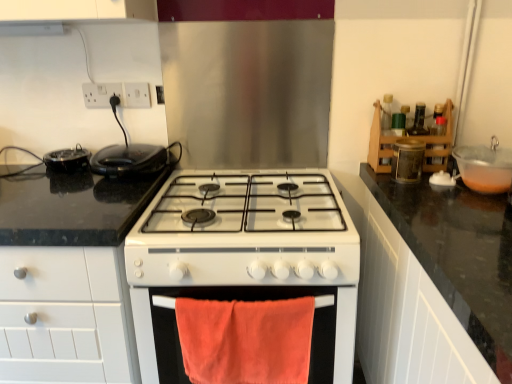
Identify the location of white plastic socket at upper left, which is the 2th electric outlet in left-to-right order. (137, 95).

What do you see at coordinates (439, 142) in the screenshot? Image resolution: width=512 pixels, height=384 pixels. I see `wooden spice rack at upper right` at bounding box center [439, 142].

The image size is (512, 384). I want to click on black granite countertop at left, so click(x=68, y=277).

From the image's perspective, is matte brown container at upper right below black glossy pan at left, arranged as the 2th kitchen appliance when viewed from the right?

Incorrect, from the image's perspective, matte brown container at upper right is higher than black glossy pan at left, arranged as the 2th kitchen appliance when viewed from the right.

Is matte brown container at upper right with black glossy pan at left, which ranks as the 1th kitchen appliance in left-to-right order?

No, matte brown container at upper right is not next to black glossy pan at left, which ranks as the 1th kitchen appliance in left-to-right order.

Is matte brown container at upper right bigger than black glossy pan at left, which ranks as the 1th kitchen appliance in left-to-right order?

Indeed, matte brown container at upper right has a larger size compared to black glossy pan at left, which ranks as the 1th kitchen appliance in left-to-right order.

What's the angular difference between orange cotton towel at lower center and white plastic socket at upper left, which appears as the second electric outlet when viewed from the right,'s facing directions?

There is a 0.0215-degree angle between the facing directions of orange cotton towel at lower center and white plastic socket at upper left, which appears as the second electric outlet when viewed from the right.

Which object is further away from the camera, orange cotton towel at lower center or white plastic socket at upper left, which appears as the 1th electric outlet when viewed from the left?

A: Positioned behind is white plastic socket at upper left, which appears as the 1th electric outlet when viewed from the left.

Does orange cotton towel at lower center touch white plastic socket at upper left, which appears as the 1th electric outlet when viewed from the left?

orange cotton towel at lower center and white plastic socket at upper left, which appears as the 1th electric outlet when viewed from the left, are not in contact.

Can you confirm if orange cotton towel at lower center is bigger than white plastic socket at upper left, which appears as the 1th electric outlet when viewed from the left?

Yes, orange cotton towel at lower center is bigger than white plastic socket at upper left, which appears as the 1th electric outlet when viewed from the left.

Can we say transparent plastic bowl at right lies outside white glossy exhaust hood at upper center?

Yes, transparent plastic bowl at right is located beyond the bounds of white glossy exhaust hood at upper center.

From a real-world perspective, is transparent plastic bowl at right below white glossy exhaust hood at upper center?

Yes, from a real-world perspective, transparent plastic bowl at right is below white glossy exhaust hood at upper center.

Is transparent plastic bowl at right positioned with its back to white glossy exhaust hood at upper center?

No, transparent plastic bowl at right is not facing the opposite direction of white glossy exhaust hood at upper center.

Looking at this image, is white plastic socket at upper left, which is the 2th electric outlet in left-to-right order, bigger than matte brown container at upper right?

Actually, white plastic socket at upper left, which is the 2th electric outlet in left-to-right order, might be smaller than matte brown container at upper right.

From the image's perspective, between white plastic socket at upper left, which is the 2th electric outlet in left-to-right order, and matte brown container at upper right, who is located below?

matte brown container at upper right appears lower in the image.

From a real-world perspective, does white plastic socket at upper left, which is counted as the first electric outlet, starting from the right, stand above matte brown container at upper right?

Indeed, from a real-world perspective, white plastic socket at upper left, which is counted as the first electric outlet, starting from the right, stands above matte brown container at upper right.

Is white plastic socket at upper left, which is counted as the first electric outlet, starting from the right, turned away from matte brown container at upper right?

No, matte brown container at upper right is not at the back of white plastic socket at upper left, which is counted as the first electric outlet, starting from the right.

Is orange cotton towel at lower center directly adjacent to black glossy waffle maker at left, which is the 1th kitchen appliance in right-to-left order?

orange cotton towel at lower center and black glossy waffle maker at left, which is the 1th kitchen appliance in right-to-left order, are clearly separated.

From a real-world perspective, which object stands above the other?

In real-world perspective, black glossy waffle maker at left, arranged as the second kitchen appliance when viewed from the left, is above.

Is orange cotton towel at lower center wider or thinner than black glossy waffle maker at left, which is the 1th kitchen appliance in right-to-left order?

In the image, orange cotton towel at lower center appears to be more narrow than black glossy waffle maker at left, which is the 1th kitchen appliance in right-to-left order.

From a real-world perspective, which object rests below the other?

black glossy pan at left, arranged as the 2th kitchen appliance when viewed from the right, is physically lower.

Is white glossy exhaust hood at upper center located outside black glossy pan at left, which ranks as the 1th kitchen appliance in left-to-right order?

white glossy exhaust hood at upper center is positioned outside black glossy pan at left, which ranks as the 1th kitchen appliance in left-to-right order.

In terms of height, does white glossy exhaust hood at upper center look taller or shorter compared to black glossy pan at left, arranged as the 2th kitchen appliance when viewed from the right?

Clearly, white glossy exhaust hood at upper center is shorter compared to black glossy pan at left, arranged as the 2th kitchen appliance when viewed from the right.

Considering the relative sizes of white glossy exhaust hood at upper center and black glossy pan at left, arranged as the 2th kitchen appliance when viewed from the right, in the image provided, is white glossy exhaust hood at upper center wider than black glossy pan at left, arranged as the 2th kitchen appliance when viewed from the right,?

No, white glossy exhaust hood at upper center is not wider than black glossy pan at left, arranged as the 2th kitchen appliance when viewed from the right.

In the scene shown: From the image's perspective, is matte brown container at upper right on white glossy gas stove at center?

Indeed, from the image's perspective, matte brown container at upper right is shown above white glossy gas stove at center.

Considering the relative positions of matte brown container at upper right and white glossy gas stove at center in the image provided, is matte brown container at upper right behind white glossy gas stove at center?

Yes, matte brown container at upper right is further from the viewer.

Is white glossy gas stove at center surrounded by matte brown container at upper right?

No, white glossy gas stove at center is not surrounded by matte brown container at upper right.

How distant is matte brown container at upper right from white glossy gas stove at center?

matte brown container at upper right is 51.75 centimeters from white glossy gas stove at center.

Where is `the 1st kitchen appliance below the matte brown container at upper right (from the image's perspective)`? The width and height of the screenshot is (512, 384). the 1st kitchen appliance below the matte brown container at upper right (from the image's perspective) is located at coordinates (67, 159).

Locate an element on the screen. The height and width of the screenshot is (384, 512). oven on the right side of white plastic socket at upper left, which appears as the second electric outlet when viewed from the right is located at coordinates (243, 300).

When comparing their distances from wooden spice rack at upper right, does white plastic socket at upper left, which appears as the 1th electric outlet when viewed from the left, or orange cotton towel at lower center seem closer?

orange cotton towel at lower center.

Estimate the real-world distances between objects in this image. Which object is closer to white glossy exhaust hood at upper center, white plastic socket at upper left, which is counted as the first electric outlet, starting from the right, or transparent plastic bowl at right?

Among the two, white plastic socket at upper left, which is counted as the first electric outlet, starting from the right, is located nearer to white glossy exhaust hood at upper center.

Considering their positions, is wooden spice rack at upper right positioned further to white glossy gas stove at center than black glossy pan at left, which ranks as the 1th kitchen appliance in left-to-right order?

black glossy pan at left, which ranks as the 1th kitchen appliance in left-to-right order, is further to white glossy gas stove at center.

Based on their spatial positions, is white plastic socket at upper left, which appears as the second electric outlet when viewed from the right, or white glossy gas stove at center further from orange cotton towel at lower center?

white plastic socket at upper left, which appears as the second electric outlet when viewed from the right, is positioned further to the anchor orange cotton towel at lower center.

Estimate the real-world distances between objects in this image. Which object is closer to black glossy waffle maker at left, which is the 1th kitchen appliance in right-to-left order, white plastic socket at upper left, which is the 2th electric outlet in left-to-right order, or black glossy pan at left, arranged as the 2th kitchen appliance when viewed from the right?

black glossy pan at left, arranged as the 2th kitchen appliance when viewed from the right, is positioned closer to the anchor black glossy waffle maker at left, which is the 1th kitchen appliance in right-to-left order.

Estimate the real-world distances between objects in this image. Which object is closer to black glossy waffle maker at left, which is the 1th kitchen appliance in right-to-left order, white glossy gas stove at center or matte brown container at upper right?

white glossy gas stove at center lies closer to black glossy waffle maker at left, which is the 1th kitchen appliance in right-to-left order, than the other object.

Considering their positions, is black granite countertop at left positioned closer to wooden spice rack at upper right than transparent plastic bowl at right?

transparent plastic bowl at right is positioned closer to the anchor wooden spice rack at upper right.

Estimate the real-world distances between objects in this image. Which object is further from white glossy exhaust hood at upper center, black granite countertop at left or transparent plastic bowl at right?

The object further to white glossy exhaust hood at upper center is transparent plastic bowl at right.

At what (x,y) coordinates should I click in order to perform the action: click on appliance located between black glossy waffle maker at left, arranged as the second kitchen appliance when viewed from the left, and wooden spice rack at upper right in the left-right direction. Please return your answer as a coordinate pair (x, y). Image resolution: width=512 pixels, height=384 pixels. Looking at the image, I should click on (407, 160).

Locate an element on the screen. Image resolution: width=512 pixels, height=384 pixels. oven between white plastic socket at upper left, which is counted as the first electric outlet, starting from the right, and black granite countertop at left in the up-down direction is located at coordinates (243, 300).

Locate an element on the screen. electric outlet between black glossy waffle maker at left, arranged as the second kitchen appliance when viewed from the left, and transparent plastic bowl at right, in the horizontal direction is located at coordinates (137, 95).

At what (x,y) coordinates should I click in order to perform the action: click on cabinetry located between black glossy waffle maker at left, which is the 1th kitchen appliance in right-to-left order, and transparent plastic bowl at right in the left-right direction. Please return your answer as a coordinate pair (x, y). The height and width of the screenshot is (384, 512). Looking at the image, I should click on (439, 142).